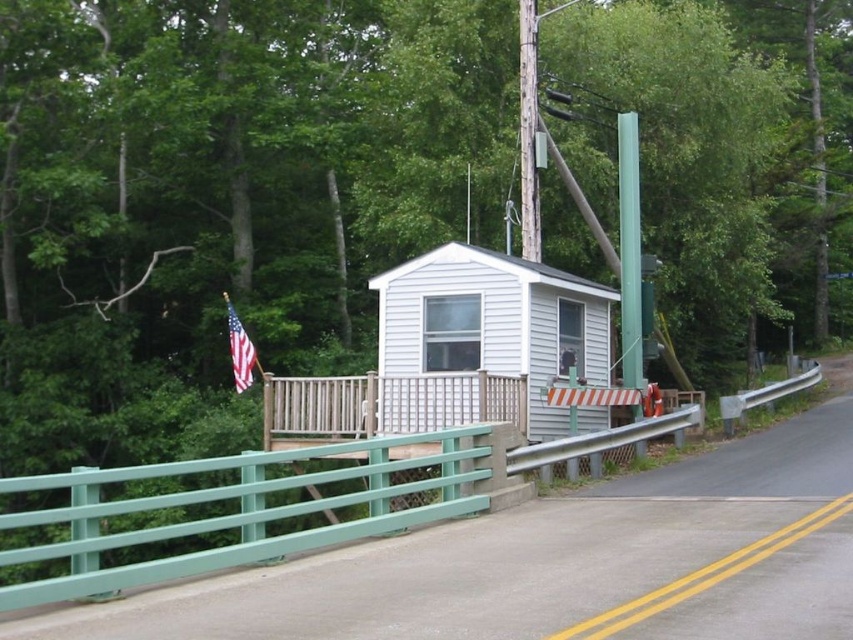
Question: Can you confirm if weathered wood pole at upper center is bigger than american flag at left?

Choices:
 (A) no
 (B) yes

Answer: (B)

Question: Which object appears closest to the camera in this image?

Choices:
 (A) green painted metal fence at lower left
 (B) american flag at left
 (C) weathered wood pole at upper center

Answer: (A)

Question: Which object appears closest to the camera in this image?

Choices:
 (A) american flag at left
 (B) weathered wood pole at upper center

Answer: (B)

Question: Can you confirm if weathered wood pole at upper center is wider than american flag at left?

Choices:
 (A) yes
 (B) no

Answer: (B)

Question: Does green painted metal fence at lower left appear on the right side of american flag at left?

Choices:
 (A) yes
 (B) no

Answer: (A)

Question: Which point is closer to the camera?

Choices:
 (A) american flag at left
 (B) green painted metal fence at lower left

Answer: (B)